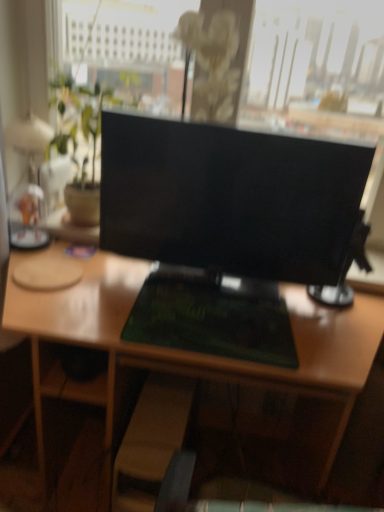
Question: Considering their positions, is wooden swivel chair at lower center located in front of or behind black glossy monitor at center?

Choices:
 (A) front
 (B) behind

Answer: (B)

Question: Looking at their shapes, would you say wooden swivel chair at lower center is wider or thinner than black glossy monitor at center?

Choices:
 (A) wide
 (B) thin

Answer: (A)

Question: Considering the real-world distances, which object is closest to the black glossy monitor at center?

Choices:
 (A) green matte desk at center
 (B) white fabric lampshade at left
 (C) wooden swivel chair at lower center

Answer: (A)

Question: Which object is the farthest from the black glossy monitor at center?

Choices:
 (A) green matte desk at center
 (B) wooden swivel chair at lower center
 (C) white fabric lampshade at left

Answer: (B)